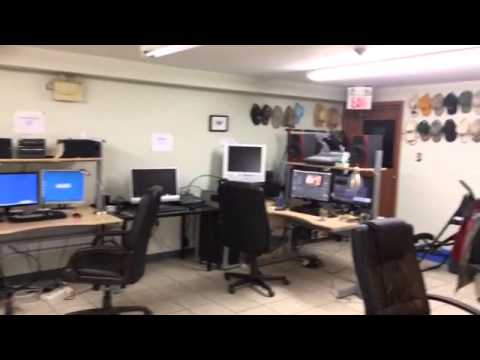
Locate an element on the screen. ceiling is located at coordinates (244, 61).